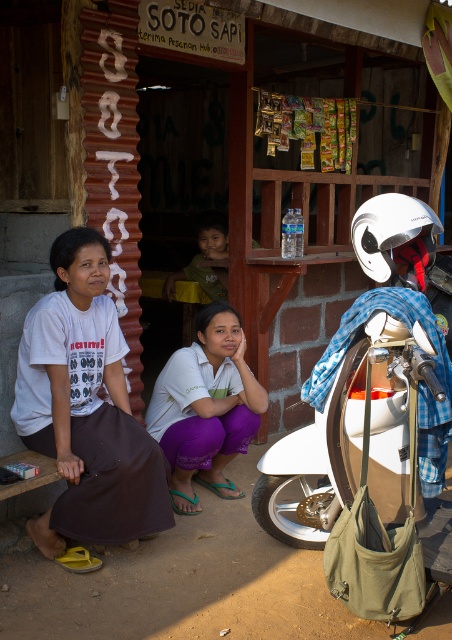
Who is taller, white matte shirt at center or green fabric shirt at upper center?

white matte shirt at center is taller.

Is white matte shirt at center wider than green fabric shirt at upper center?

Yes.

The width and height of the screenshot is (452, 640). What do you see at coordinates (206, 406) in the screenshot?
I see `white matte shirt at center` at bounding box center [206, 406].

Image resolution: width=452 pixels, height=640 pixels. Identify the location of white matte shirt at center. (206, 406).

Locate an element on the screen. This screenshot has height=640, width=452. purple fabric skirt at lower left is located at coordinates (85, 406).

Who is shorter, purple fabric skirt at lower left or white matte shirt at center?

With less height is white matte shirt at center.

Does point (62, 358) come farther from viewer compared to point (226, 440)?

That is False.

Locate an element on the screen. This screenshot has height=640, width=452. purple fabric skirt at lower left is located at coordinates (85, 406).

Can you confirm if white matte motorcycle at center is positioned above white matte shirt at center?

Indeed, white matte motorcycle at center is positioned over white matte shirt at center.

Is point (372, 468) more distant than point (192, 513)?

No, (372, 468) is in front of (192, 513).

Who is more forward, (314, 387) or (217, 465)?

Point (314, 387) is more forward.

This screenshot has height=640, width=452. What are the coordinates of `white matte motorcycle at center` in the screenshot? It's located at (362, 380).